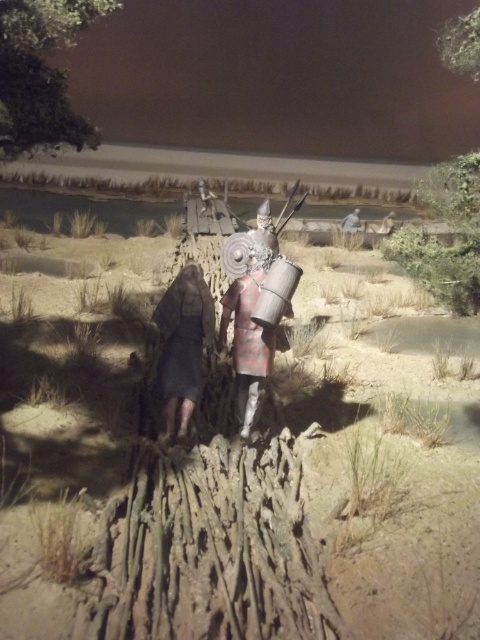
You are an explorer in this historical diorama scene. You need to determine which object occupies more horizontal space in the image. Which one is wider between the green leafy tree at upper left and the dark gray fabric dress at center?

The green leafy tree at upper left is wider than the dark gray fabric dress at center according to the description.

You are an observer looking at the diorama scene. You notice the shiny silver armor at center and the dark gray fabric dress at center. Which object is closer to you?

The shiny silver armor at center is closer to you because the dark gray fabric dress at center is behind it.